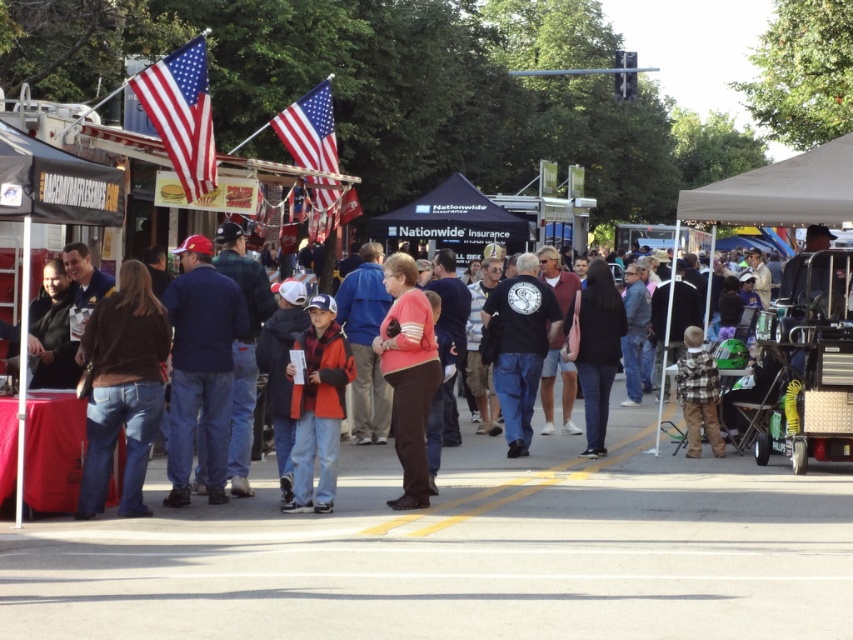
You are a tailor at the event and need to determine which jacket to display first. Since the brown leather jacket at left is taller than the orange fleece jacket at center, which one should you choose to place on the higher display rack?

The brown leather jacket at left should be placed on the higher display rack because it has a greater height compared to the orange fleece jacket at center.

You are standing at the entrance of the event and want to find the blue denim jeans at center. According to the coordinates provided, in which direction should you walk to reach them?

The blue denim jeans at center are located at coordinates point (x=200, y=368). Since the coordinates are in 2D space, moving towards the center of the image from the entrance would lead you to the blue denim jeans at center.

You are a photographer at the event and want to capture both the polished metallic flag at upper center and the plaid flannel shirt at lower right in the same frame. Based on their positions, which object should you focus on first to ensure both are in the shot?

The polished metallic flag at upper center is positioned on the left side of the plaid flannel shirt at lower right, so you should focus on the plaid flannel shirt at lower right first to ensure both are in the frame.